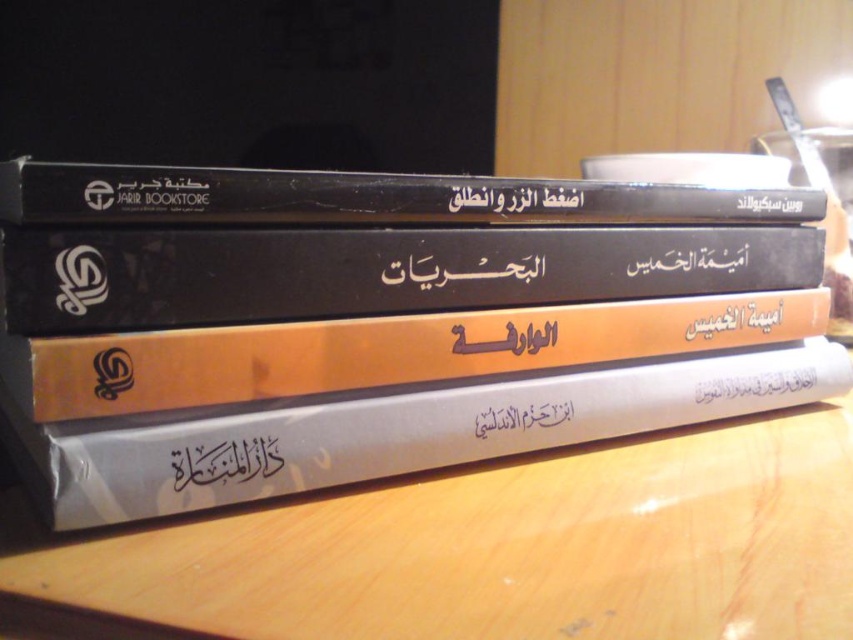
You are organizing a desk and need to place both the white paper at center and the black matte book at upper center. Since the desk space is limited, which item should you prioritize keeping if you can only keep one due to size?

The white paper at center is bigger than the black matte book at upper center, so you should prioritize keeping the white paper at center if space is limited.

You are organizing a desk and see the white paper at center and the black matte book at upper center. Which item is shorter in height?

The white paper at center is shorter in height compared to the black matte book at upper center.